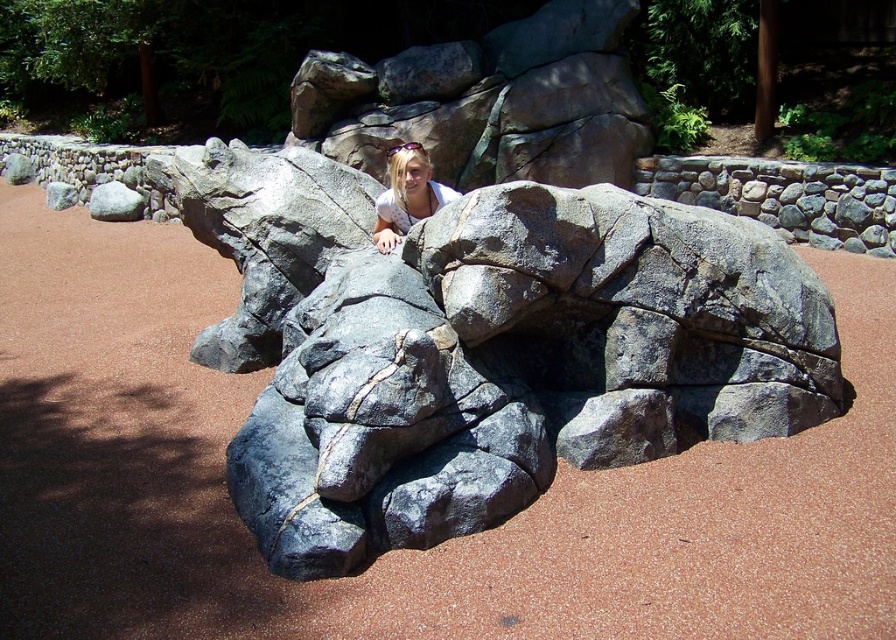
Question: Which object is farther from the camera taking this photo?

Choices:
 (A) gray rough rock at center
 (B) gray rough rock at upper left

Answer: (B)

Question: From the image, what is the correct spatial relationship of gray rough rock at center in relation to blonde hair at center?

Choices:
 (A) below
 (B) above

Answer: (A)

Question: Which point is closer to the camera taking this photo?

Choices:
 (A) (100, 188)
 (B) (350, 497)
 (C) (392, 221)

Answer: (B)

Question: Is gray rough rock at center smaller than gray rough rock at upper left?

Choices:
 (A) no
 (B) yes

Answer: (A)

Question: Is the position of blonde hair at center less distant than that of gray rough rock at upper left?

Choices:
 (A) no
 (B) yes

Answer: (B)

Question: Based on their relative distances, which object is farther from the gray rough rock at upper left?

Choices:
 (A) gray rough rock at center
 (B) blonde hair at center

Answer: (A)